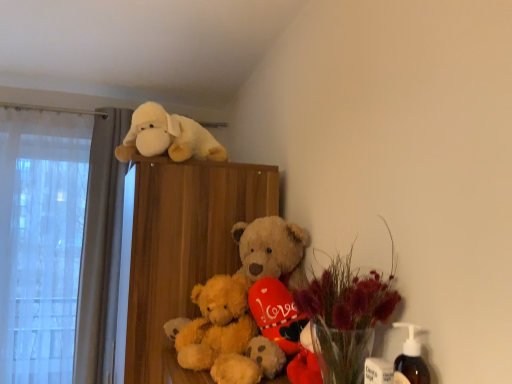
Question: In which direction should I rotate to look at translucent glass vase at center, the 2th floral arrangement in the front-to-back sequence?

Choices:
 (A) left
 (B) right

Answer: (B)

Question: Can you confirm if fluffy golden teddy bear at center is positioned to the left of fluffy white plush dog at upper center?

Choices:
 (A) yes
 (B) no

Answer: (B)

Question: Can you confirm if fluffy golden teddy bear at center is bigger than fluffy white plush dog at upper center?

Choices:
 (A) yes
 (B) no

Answer: (B)

Question: Can you confirm if fluffy golden teddy bear at center is shorter than fluffy white plush dog at upper center?

Choices:
 (A) yes
 (B) no

Answer: (B)

Question: Is fluffy golden teddy bear at center not near fluffy white plush dog at upper center?

Choices:
 (A) no
 (B) yes

Answer: (A)

Question: Is fluffy golden teddy bear at center placed right next to fluffy white plush dog at upper center?

Choices:
 (A) yes
 (B) no

Answer: (B)

Question: Does fluffy golden teddy bear at center have a smaller size compared to fluffy white plush dog at upper center?

Choices:
 (A) yes
 (B) no

Answer: (A)

Question: Can you confirm if translucent glass vase at center, the 2th floral arrangement in the front-to-back sequence, is thinner than translucent glass vase with dried flowers at lower right, which is the first floral arrangement from front to back?

Choices:
 (A) yes
 (B) no

Answer: (B)

Question: Is translucent glass vase at center, which appears as the first floral arrangement when viewed from the back, facing away from translucent glass vase with dried flowers at lower right, the 2th floral arrangement in the back-to-front sequence?

Choices:
 (A) yes
 (B) no

Answer: (B)

Question: Considering the relative sizes of translucent glass vase at center, which appears as the first floral arrangement when viewed from the back, and translucent glass vase with dried flowers at lower right, the 2th floral arrangement in the back-to-front sequence, in the image provided, is translucent glass vase at center, which appears as the first floral arrangement when viewed from the back, bigger than translucent glass vase with dried flowers at lower right, the 2th floral arrangement in the back-to-front sequence,?

Choices:
 (A) no
 (B) yes

Answer: (B)

Question: Is translucent glass vase at center, the 2th floral arrangement in the front-to-back sequence, closer to the viewer compared to translucent glass vase with dried flowers at lower right, which is the first floral arrangement from front to back?

Choices:
 (A) no
 (B) yes

Answer: (A)

Question: Does translucent glass vase at center, which appears as the first floral arrangement when viewed from the back, have a greater width compared to translucent glass vase with dried flowers at lower right, the 2th floral arrangement in the back-to-front sequence?

Choices:
 (A) yes
 (B) no

Answer: (A)

Question: Could you tell me if translucent glass vase at center, the 2th floral arrangement in the front-to-back sequence, is turned towards translucent glass vase with dried flowers at lower right, which is the first floral arrangement from front to back?

Choices:
 (A) yes
 (B) no

Answer: (B)

Question: Does fluffy white plush dog at upper center have a lesser width compared to fluffy golden teddy bear at center?

Choices:
 (A) yes
 (B) no

Answer: (B)